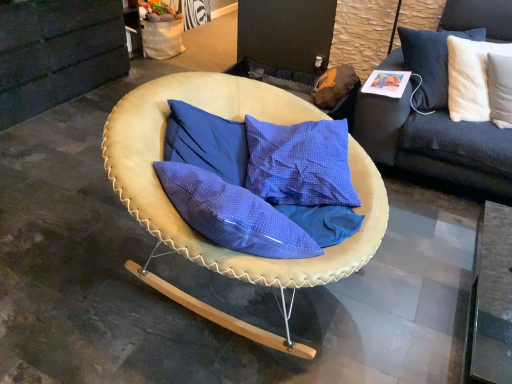
Question: Should I look upward or downward to see dark gray fabric couch at upper right?

Choices:
 (A) down
 (B) up

Answer: (B)

Question: Can you confirm if white soft cushion at upper right is wider than dark gray fabric couch at upper right?

Choices:
 (A) no
 (B) yes

Answer: (A)

Question: Considering the relative positions of white soft cushion at upper right and dark gray fabric couch at upper right in the image provided, is white soft cushion at upper right to the right of dark gray fabric couch at upper right from the viewer's perspective?

Choices:
 (A) no
 (B) yes

Answer: (B)

Question: Considering the relative sizes of white soft cushion at upper right and dark gray fabric couch at upper right in the image provided, is white soft cushion at upper right shorter than dark gray fabric couch at upper right?

Choices:
 (A) no
 (B) yes

Answer: (B)

Question: Is white soft cushion at upper right oriented away from dark gray fabric couch at upper right?

Choices:
 (A) no
 (B) yes

Answer: (B)

Question: Considering the relative sizes of white soft cushion at upper right and dark gray fabric couch at upper right in the image provided, is white soft cushion at upper right taller than dark gray fabric couch at upper right?

Choices:
 (A) no
 (B) yes

Answer: (A)

Question: Are white soft cushion at upper right and dark gray fabric couch at upper right far apart?

Choices:
 (A) yes
 (B) no

Answer: (B)

Question: Is dark gray fabric couch at upper right at the right side of leather-like beige chair at center?

Choices:
 (A) no
 (B) yes

Answer: (B)

Question: Is dark gray fabric couch at upper right far from leather-like beige chair at center?

Choices:
 (A) no
 (B) yes

Answer: (A)

Question: Can we say dark gray fabric couch at upper right lies outside leather-like beige chair at center?

Choices:
 (A) no
 (B) yes

Answer: (B)

Question: Is dark gray fabric couch at upper right taller than leather-like beige chair at center?

Choices:
 (A) yes
 (B) no

Answer: (A)

Question: Is dark gray fabric couch at upper right oriented away from leather-like beige chair at center?

Choices:
 (A) no
 (B) yes

Answer: (A)

Question: Is leather-like beige chair at center surrounded by dark gray fabric couch at upper right?

Choices:
 (A) yes
 (B) no

Answer: (B)

Question: From the image's perspective, is dark gray fabric couch at upper right below white soft cushion at upper right?

Choices:
 (A) no
 (B) yes

Answer: (A)